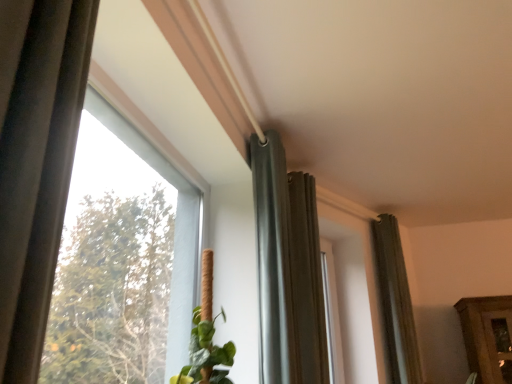
Question: From a real-world perspective, is dark gray fabric curtain at center, the first curtain when ordered from left to right, physically below matte gray curtain at center, the 2th curtain when ordered from left to right?

Choices:
 (A) no
 (B) yes

Answer: (A)

Question: Is dark gray fabric curtain at center, the first curtain when ordered from left to right, not inside matte gray curtain at center, which appears as the 2th curtain when viewed from the front?

Choices:
 (A) yes
 (B) no

Answer: (A)

Question: Considering the relative sizes of dark gray fabric curtain at center, the 3th curtain when ordered from back to front, and matte gray curtain at center, which appears as the 2th curtain when viewed from the front, in the image provided, is dark gray fabric curtain at center, the 3th curtain when ordered from back to front, thinner than matte gray curtain at center, which appears as the 2th curtain when viewed from the front,?

Choices:
 (A) yes
 (B) no

Answer: (A)

Question: Considering the relative sizes of dark gray fabric curtain at center, positioned as the third curtain in right-to-left order, and matte gray curtain at center, the 2th curtain when ordered from left to right, in the image provided, is dark gray fabric curtain at center, positioned as the third curtain in right-to-left order, shorter than matte gray curtain at center, the 2th curtain when ordered from left to right,?

Choices:
 (A) no
 (B) yes

Answer: (B)

Question: Is the position of dark gray fabric curtain at center, which ranks as the 1th curtain in front-to-back order, less distant than that of matte gray curtain at center, which appears as the 2th curtain when viewed from the front?

Choices:
 (A) no
 (B) yes

Answer: (B)

Question: From the image's perspective, is dark gray fabric curtain at center, the first curtain when ordered from left to right, under matte gray curtain at center, the 2th curtain when ordered from left to right?

Choices:
 (A) no
 (B) yes

Answer: (A)

Question: Is dark gray fabric curtain at right, arranged as the 1th curtain when viewed from the right, at the left side of matte gray curtain at center, the 2th curtain when ordered from left to right?

Choices:
 (A) yes
 (B) no

Answer: (B)

Question: Is dark gray fabric curtain at right, arranged as the 1th curtain when viewed from the right, in front of matte gray curtain at center, which appears as the 2th curtain when viewed from the front?

Choices:
 (A) yes
 (B) no

Answer: (B)

Question: Could you tell me if dark gray fabric curtain at right, the 3th curtain viewed from the left, is facing matte gray curtain at center, which appears as the 2th curtain when viewed from the front?

Choices:
 (A) no
 (B) yes

Answer: (A)

Question: Does dark gray fabric curtain at right, arranged as the 1th curtain when viewed from the right, contain matte gray curtain at center, the second curtain when ordered from back to front?

Choices:
 (A) no
 (B) yes

Answer: (A)

Question: Is dark gray fabric curtain at right, which is the 1th curtain in back-to-front order, outside matte gray curtain at center, which appears as the 2th curtain when viewed from the front?

Choices:
 (A) no
 (B) yes

Answer: (B)

Question: Considering the relative sizes of dark gray fabric curtain at right, the 3th curtain viewed from the left, and matte gray curtain at center, the 2th curtain when ordered from left to right, in the image provided, is dark gray fabric curtain at right, the 3th curtain viewed from the left, shorter than matte gray curtain at center, the 2th curtain when ordered from left to right,?

Choices:
 (A) no
 (B) yes

Answer: (A)

Question: Are dark gray fabric curtain at center, which ranks as the 1th curtain in front-to-back order, and transparent glass window at upper left far apart?

Choices:
 (A) yes
 (B) no

Answer: (B)